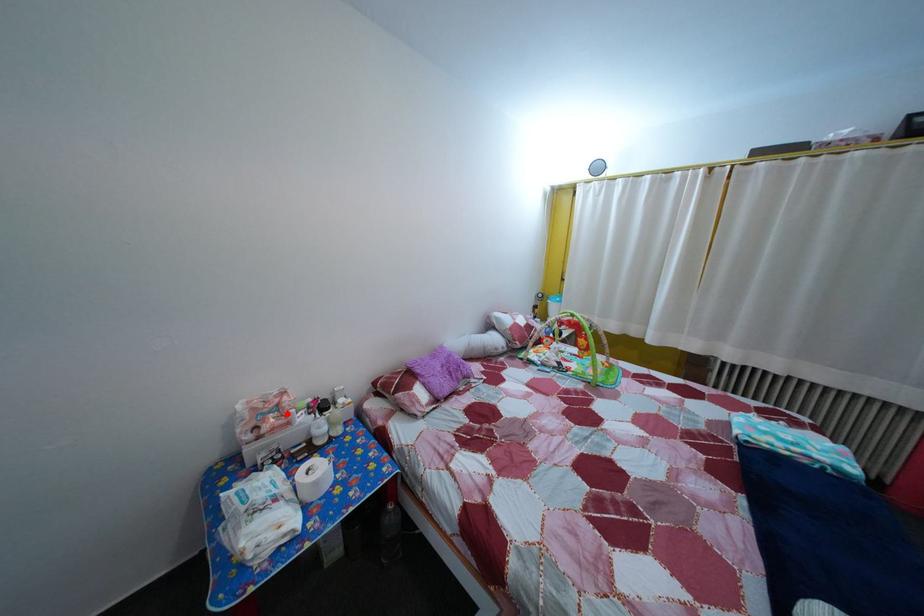
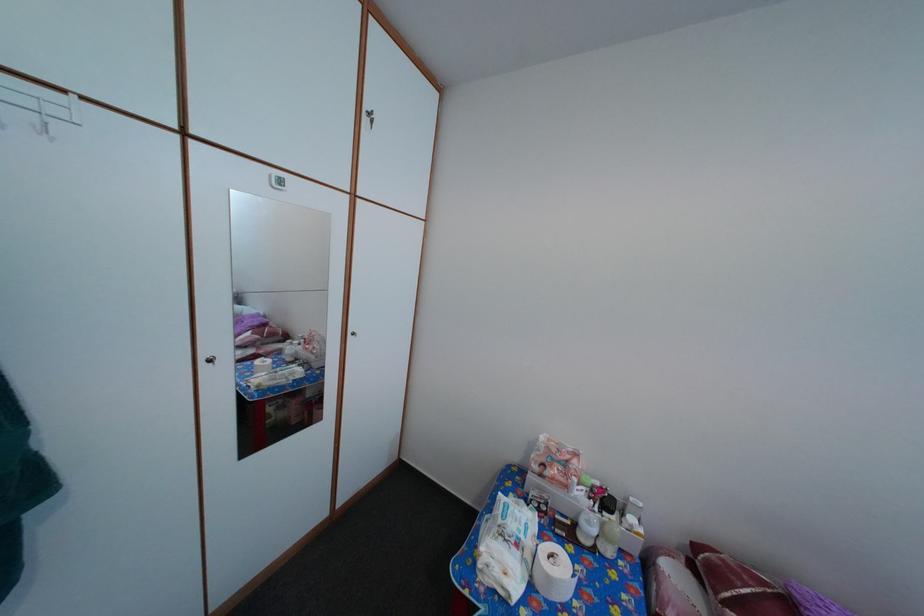
Where in the second image is the point corresponding to the highlighted location from the first image?

(576, 469)